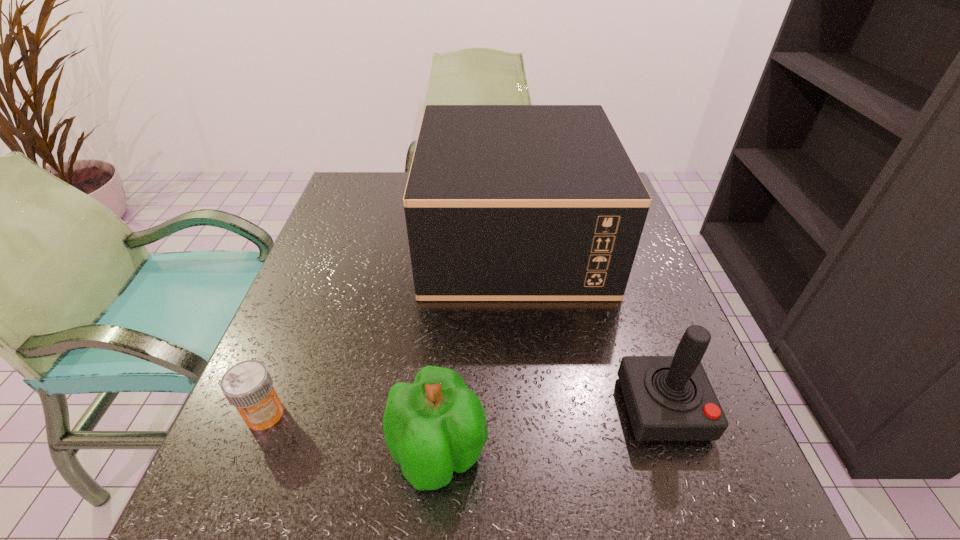
Where is `free region located on the left of the bell pepper`? Image resolution: width=960 pixels, height=540 pixels. free region located on the left of the bell pepper is located at coordinates (294, 454).

Image resolution: width=960 pixels, height=540 pixels. I want to click on free spot located 0.090m on the label side of the leftmost object, so click(x=234, y=489).

Locate an element on the screen. This screenshot has height=540, width=960. object present at the far edge is located at coordinates (503, 202).

I want to click on object that is at the near edge, so click(x=436, y=425).

You are a GUI agent. You are given a task and a screenshot of the screen. Output one action in this format:
    pyautogui.click(x=<x>, y=<y>)
    Task: Click on the object situated at the left edge
    Image resolution: width=960 pixels, height=540 pixels.
    Given the screenshot: What is the action you would take?
    pyautogui.click(x=248, y=386)

The height and width of the screenshot is (540, 960). I want to click on box at the right edge, so click(503, 202).

Locate an element on the screen. The image size is (960, 540). joystick at the right edge is located at coordinates (669, 398).

This screenshot has height=540, width=960. Identify the location of object positioned at the far right corner. (503, 202).

At what (x,y) coordinates should I click in order to perform the action: click on vacant space at the near edge of the desktop. Please return your answer as a coordinate pair (x, y). Looking at the image, I should click on pyautogui.click(x=532, y=528).

In the image, there is a desktop. What are the coordinates of `free space at the left edge` in the screenshot? It's located at (318, 282).